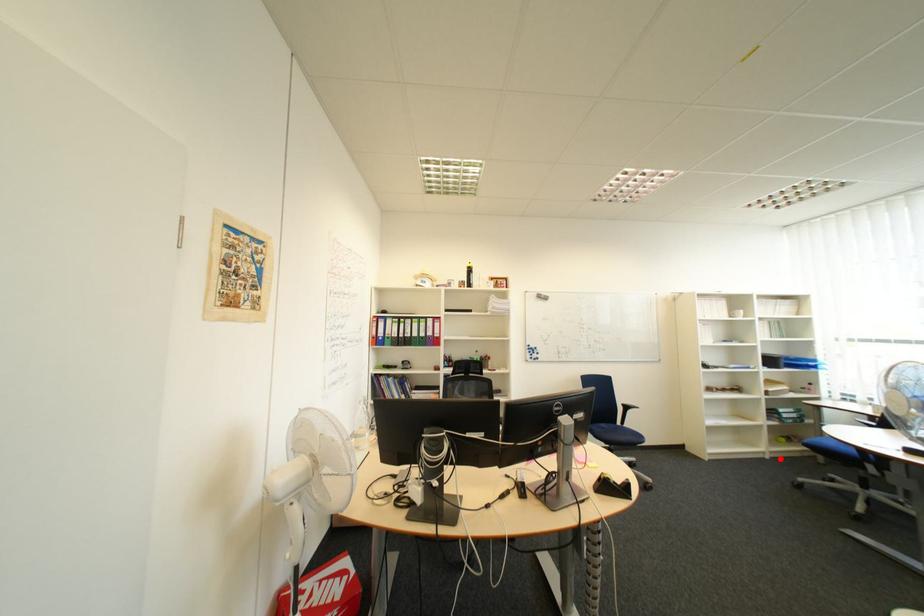
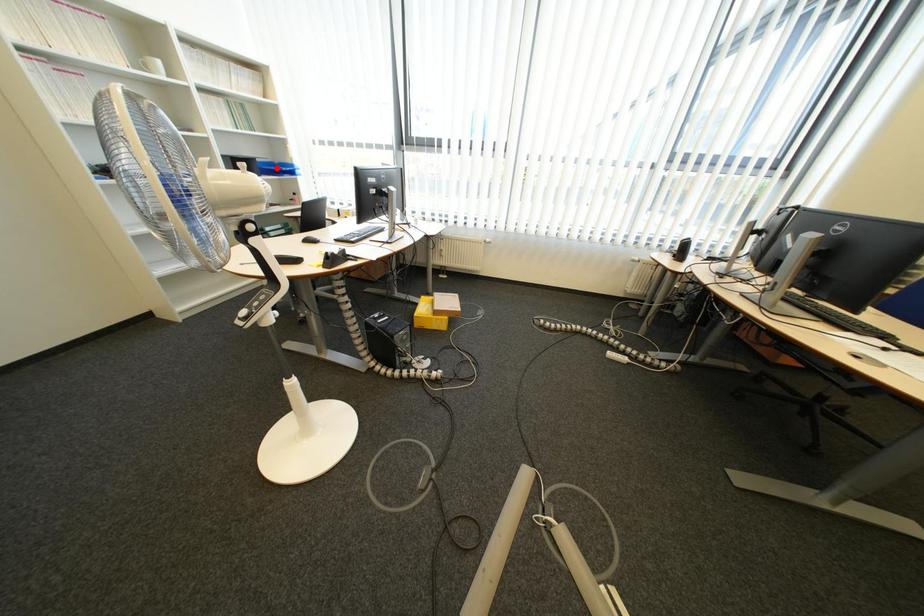
Based on the photo, I am providing you with two images of the same scene from different viewpoints. A red point is marked on the first image and another point is marked on the second image. Are the points marked in image1 and image2 representing the same 3D position?

No